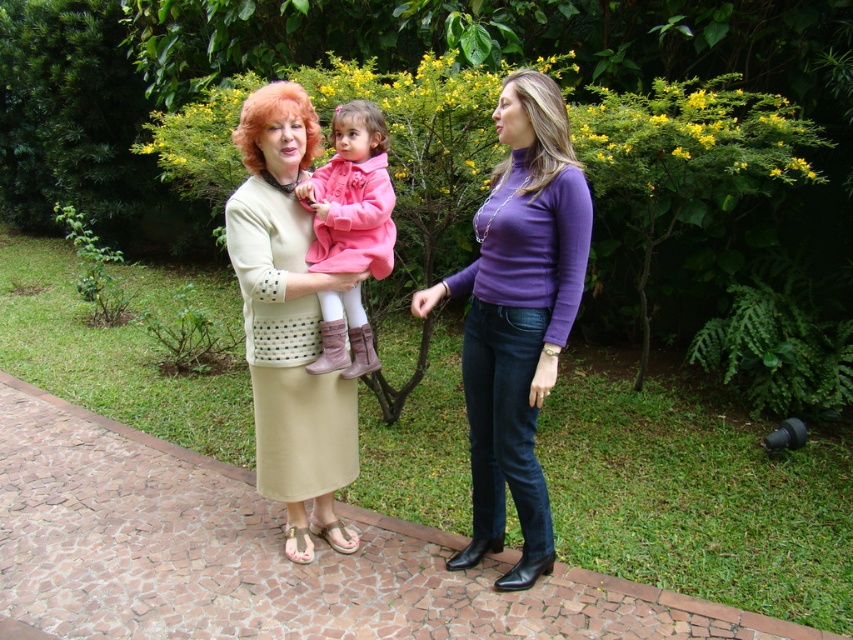
Based on the photo, between pink matte coat at center and smooth purple turtleneck at center, which one has less height?

smooth purple turtleneck at center

From the picture: Who is more forward, (338, 115) or (527, 84)?

Point (527, 84) is more forward.

The height and width of the screenshot is (640, 853). I want to click on pink matte coat at center, so click(x=352, y=196).

Can you confirm if smooth purple turtleneck at center is smaller than blonde synthetic wig at center?

Yes.

Is point (554, 154) positioned behind point (280, 92)?

No.

This screenshot has width=853, height=640. What are the coordinates of `smooth purple turtleneck at center` in the screenshot? It's located at (543, 125).

Looking at this image, does purple turtleneck sweater at center have a smaller size compared to smooth purple turtleneck at center?

Incorrect, purple turtleneck sweater at center is not smaller in size than smooth purple turtleneck at center.

I want to click on purple turtleneck sweater at center, so click(518, 316).

Between point (512, 300) and point (512, 77), which one is positioned in front?

Positioned in front is point (512, 77).

Locate an element on the screen. The height and width of the screenshot is (640, 853). purple turtleneck sweater at center is located at coordinates (518, 316).